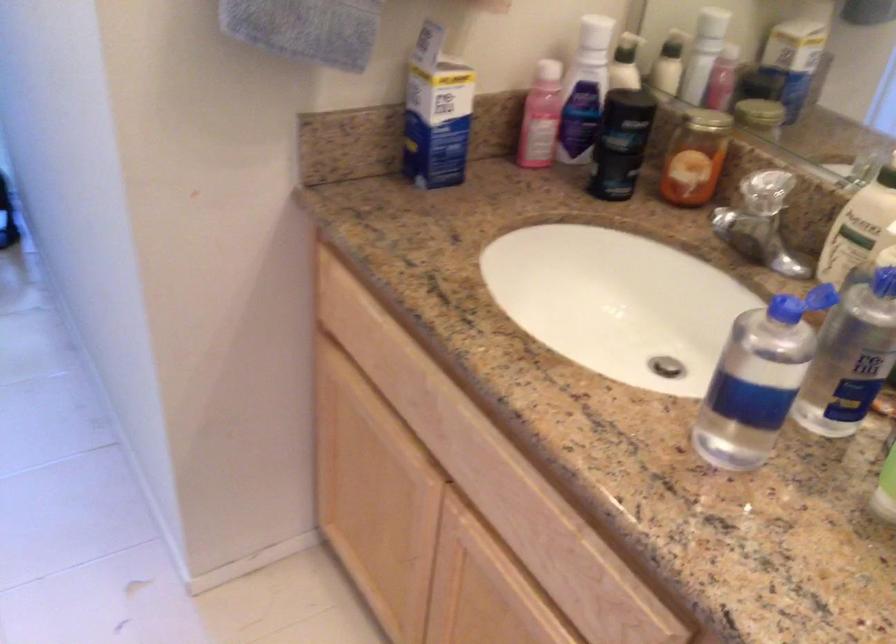
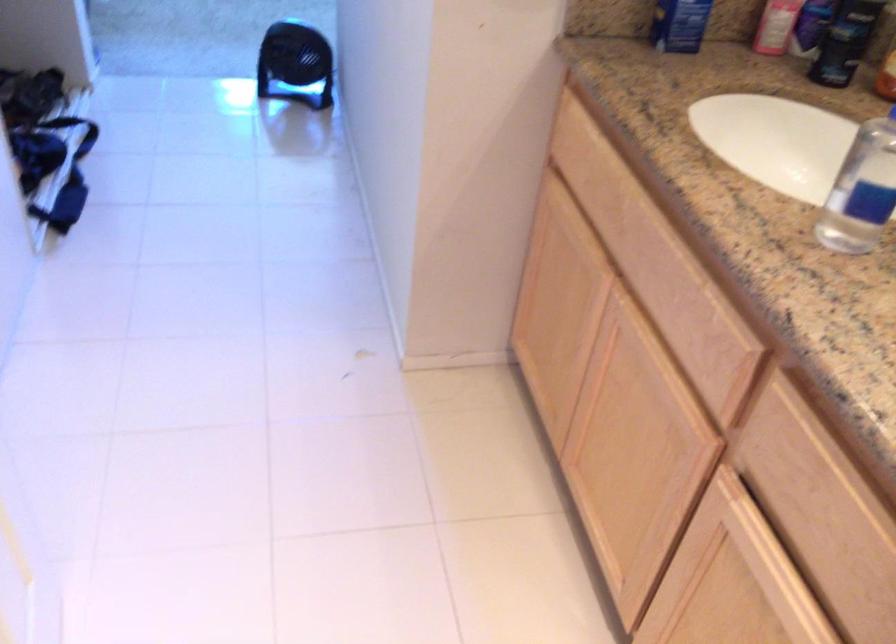
Locate, in the second image, the point that corresponds to the point at 624,149 in the first image.

(845, 41)